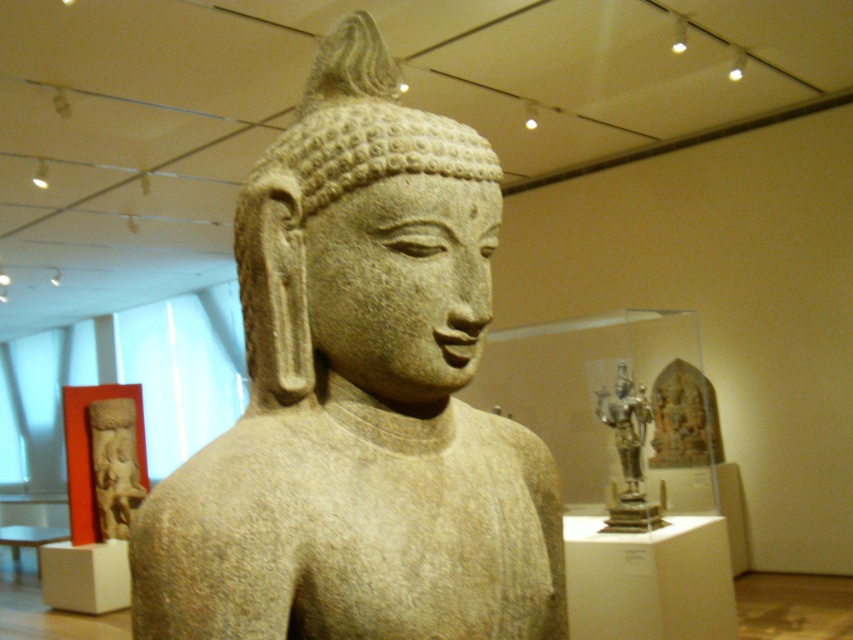
Question: Which of the following is the farthest from the observer?

Choices:
 (A) granite statue at center
 (B) polished bronze statue at center

Answer: (B)

Question: Can you confirm if carved stone figure at left is bigger than polished bronze statue at center?

Choices:
 (A) yes
 (B) no

Answer: (A)

Question: Is carved stone figure at left to the right of polished bronze statue at center from the viewer's perspective?

Choices:
 (A) no
 (B) yes

Answer: (A)

Question: Which point appears closest to the camera in this image?

Choices:
 (A) (379, 58)
 (B) (103, 452)
 (C) (323, 264)
 (D) (631, 420)

Answer: (C)

Question: Which object appears farthest from the camera in this image?

Choices:
 (A) granite statue at center
 (B) carved stone figure at left

Answer: (B)

Question: Can you confirm if carved stone figure at left is positioned to the right of polished bronze statue at center?

Choices:
 (A) yes
 (B) no

Answer: (B)